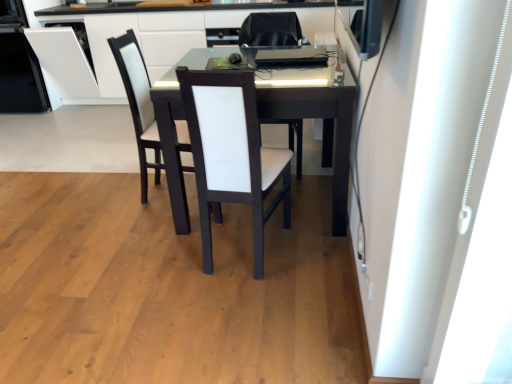
The height and width of the screenshot is (384, 512). Find the location of `free location in front of white leather chair at center, which is the first chair from back to front`. free location in front of white leather chair at center, which is the first chair from back to front is located at coordinates [233, 295].